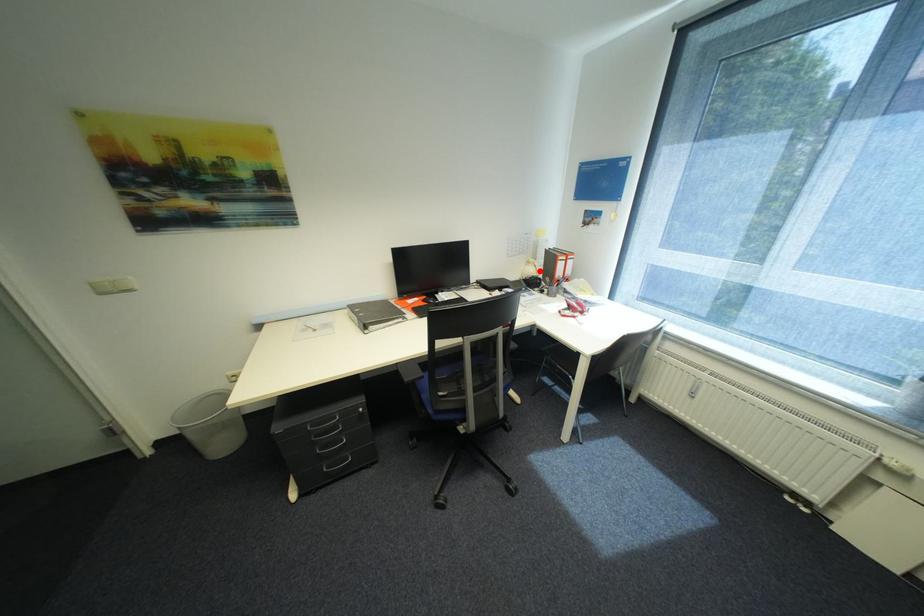
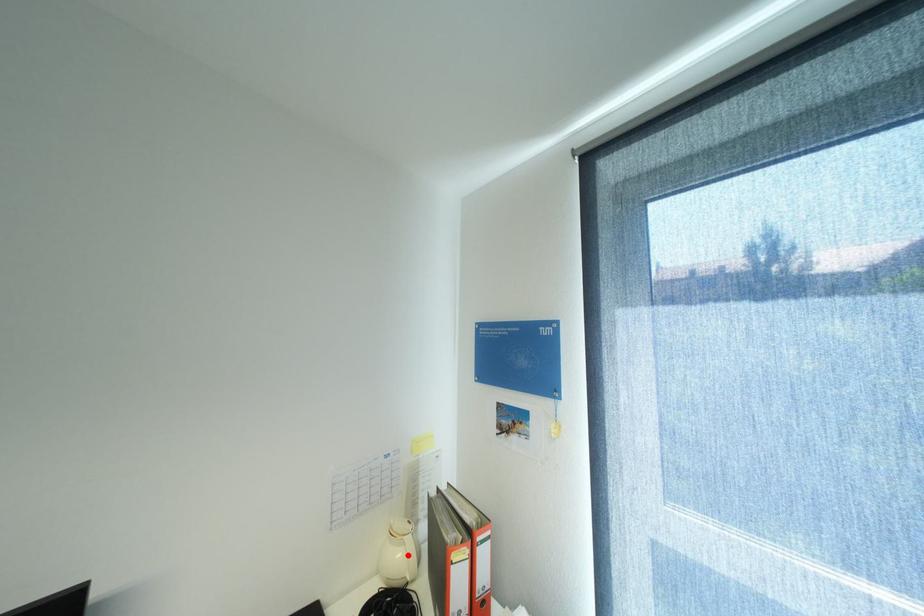
I am providing you with two images of the same scene from different viewpoints. A red point is marked on the first image and another point is marked on the second image. Do the highlighted points in image1 and image2 indicate the same real-world spot?

Yes